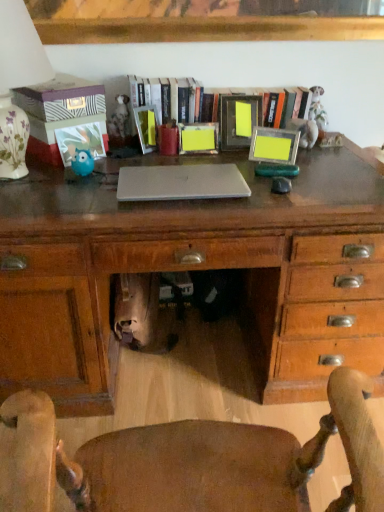
Identify the location of blank space situated above satin silver laptop at center (from a real-world perspective). This screenshot has height=512, width=384. coord(176,178).